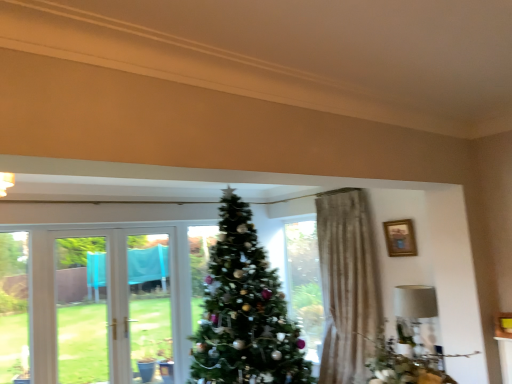
Question: From a real-world perspective, is green textured christmas tree at center under white fabric lampshade at right?

Choices:
 (A) yes
 (B) no

Answer: (B)

Question: Is green textured christmas tree at center oriented towards white fabric lampshade at right?

Choices:
 (A) yes
 (B) no

Answer: (B)

Question: Would you say green textured christmas tree at center is outside white fabric lampshade at right?

Choices:
 (A) no
 (B) yes

Answer: (B)

Question: Is green textured christmas tree at center surrounding white fabric lampshade at right?

Choices:
 (A) no
 (B) yes

Answer: (A)

Question: Can you confirm if green textured christmas tree at center is taller than white fabric lampshade at right?

Choices:
 (A) no
 (B) yes

Answer: (B)

Question: Is green textured christmas tree at center positioned with its back to white fabric lampshade at right?

Choices:
 (A) no
 (B) yes

Answer: (A)

Question: Does white fabric lampshade at right come in front of green textured christmas tree at center?

Choices:
 (A) yes
 (B) no

Answer: (B)

Question: Could you tell me if white fabric lampshade at right is turned towards green textured christmas tree at center?

Choices:
 (A) yes
 (B) no

Answer: (B)

Question: Is white fabric lampshade at right outside of green textured christmas tree at center?

Choices:
 (A) no
 (B) yes

Answer: (B)

Question: Is white fabric lampshade at right shorter than green textured christmas tree at center?

Choices:
 (A) no
 (B) yes

Answer: (B)

Question: Would you say white fabric lampshade at right is a long distance from green textured christmas tree at center?

Choices:
 (A) no
 (B) yes

Answer: (B)

Question: Is green textured christmas tree at center at the back of white fabric lampshade at right?

Choices:
 (A) no
 (B) yes

Answer: (A)

Question: Can you confirm if wooden framed picture at upper right is shorter than white fabric lampshade at right?

Choices:
 (A) yes
 (B) no

Answer: (A)